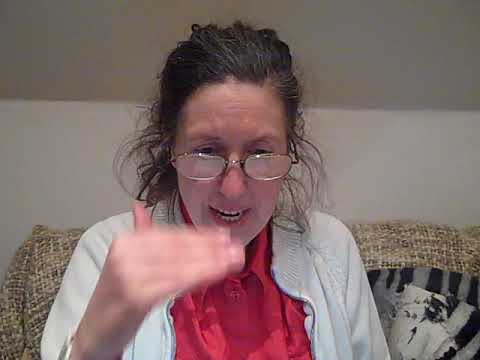
This screenshot has width=480, height=360. What are the coordinates of `brown tweed fabric` in the screenshot? It's located at (43, 299).